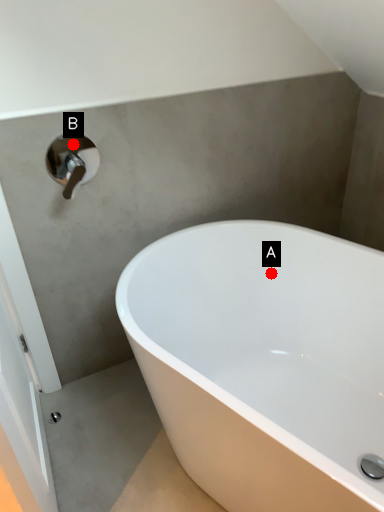
Question: Two points are circled on the image, labeled by A and B beside each circle. Which point is farther to the camera?

Choices:
 (A) A is further
 (B) B is further

Answer: (A)